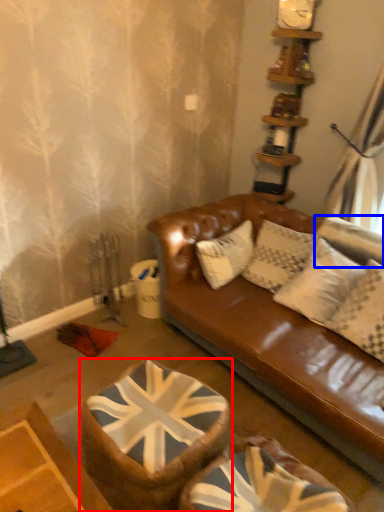
Question: Which point is closer to the camera, swivel chair (highlighted by a red box) or pillow (highlighted by a blue box)?

Choices:
 (A) swivel chair
 (B) pillow

Answer: (A)